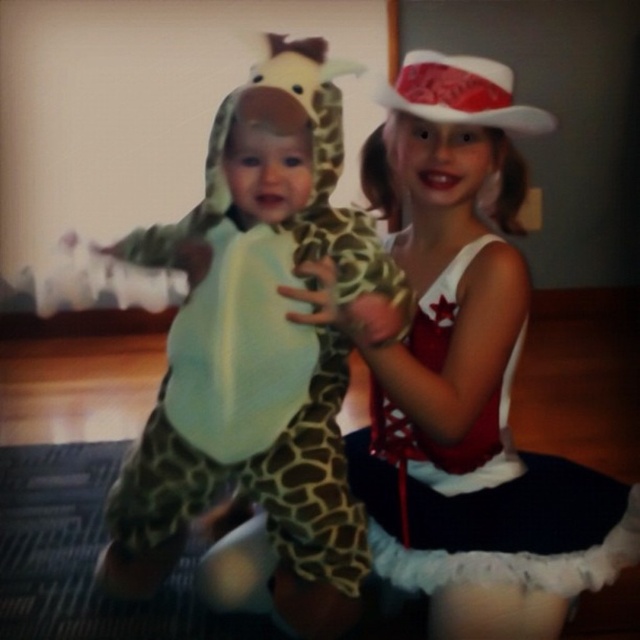
You are a photographer setting up for a childrens photoshoot. You need to place a small prop between the spotted fabric giraffe at left and the white felt cowboy hat at upper center. Where should you position the prop so it is equidistant from both objects?

The spotted fabric giraffe at left is closer to the viewer than the white felt cowboy hat at upper center, so to place the prop equidistant from both, position it closer to the white felt cowboy hat at upper center since it is farther away.